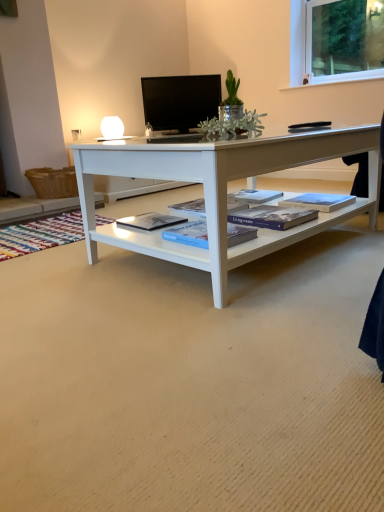
Find the location of a particular element. Image resolution: width=384 pixels, height=512 pixels. hardcover book at center, the 4th book viewed from the right is located at coordinates (151, 221).

The height and width of the screenshot is (512, 384). What do you see at coordinates (272, 217) in the screenshot?
I see `blue matte book at center, the 2th book when ordered from right to left` at bounding box center [272, 217].

Identify the location of blue matte book at center, marked as the second book in a left-to-right arrangement. (189, 234).

Measure the distance between point (x=230, y=237) and camera.

The depth of point (x=230, y=237) is 4.65 feet.

Identify the location of black glossy tv at upper center. The width and height of the screenshot is (384, 512). (180, 101).

Which is less distant, [301,202] or [189,80]?

Point [301,202] is closer to the camera than point [189,80].

From a real-world perspective, is blue hardcover book at center, which is the 1th book in right-to-left order, physically below black glossy tv at upper center?

Correct, in the physical world, blue hardcover book at center, which is the 1th book in right-to-left order, is lower than black glossy tv at upper center.

Is blue hardcover book at center, which is the fourth book from left to right, at the left side of black glossy tv at upper center?

Incorrect, blue hardcover book at center, which is the fourth book from left to right, is not on the left side of black glossy tv at upper center.

Considering the relative sizes of blue hardcover book at center, which is the fourth book from left to right, and black glossy tv at upper center in the image provided, is blue hardcover book at center, which is the fourth book from left to right, shorter than black glossy tv at upper center?

Indeed, blue hardcover book at center, which is the fourth book from left to right, has a lesser height compared to black glossy tv at upper center.

Between blue matte book at center, marked as the second book in a left-to-right arrangement, and blue matte book at center, the 2th book when ordered from right to left, which one has more height?

blue matte book at center, marked as the second book in a left-to-right arrangement, is taller.

From a real-world perspective, relative to blue matte book at center, arranged as the 3th book when viewed from the left, is blue matte book at center, arranged as the third book when viewed from the right, vertically above or below?

Clearly, from a real-world perspective, blue matte book at center, arranged as the third book when viewed from the right, is above blue matte book at center, arranged as the 3th book when viewed from the left.

Consider the image. Could you tell me if blue matte book at center, arranged as the third book when viewed from the right, is turned towards blue matte book at center, arranged as the 3th book when viewed from the left?

No, blue matte book at center, arranged as the third book when viewed from the right, is not turned towards blue matte book at center, arranged as the 3th book when viewed from the left.

From the image's perspective, is blue matte book at center, marked as the second book in a left-to-right arrangement, above blue matte book at center, the 2th book when ordered from right to left?

No, from the image's perspective, blue matte book at center, marked as the second book in a left-to-right arrangement, is not on top of blue matte book at center, the 2th book when ordered from right to left.

This screenshot has height=512, width=384. Find the location of `book below the blue matte book at center, the 2th book when ordered from right to left (from a real-world perspective)`. book below the blue matte book at center, the 2th book when ordered from right to left (from a real-world perspective) is located at coordinates (151, 221).

Considering their positions, is blue matte book at center, the 2th book when ordered from right to left, located in front of or behind hardcover book at center, the first book positioned from the left?

In the image, blue matte book at center, the 2th book when ordered from right to left, appears in front of hardcover book at center, the first book positioned from the left.

From the image's perspective, which one is positioned lower, blue matte book at center, arranged as the 3th book when viewed from the left, or hardcover book at center, the 4th book viewed from the right?

hardcover book at center, the 4th book viewed from the right.

How many degrees apart are the facing directions of blue matte book at center, the 2th book when ordered from right to left, and hardcover book at center, the first book positioned from the left?

They differ by 0.811 degrees in their facing directions.

Is hardcover book at center, the first book positioned from the left, behind blue matte book at center, arranged as the third book when viewed from the right?

Yes, hardcover book at center, the first book positioned from the left, is further from the viewer.

Is hardcover book at center, the 4th book viewed from the right, at the left side of blue matte book at center, marked as the second book in a left-to-right arrangement?

Indeed, hardcover book at center, the 4th book viewed from the right, is positioned on the left side of blue matte book at center, marked as the second book in a left-to-right arrangement.

Are hardcover book at center, the 4th book viewed from the right, and blue matte book at center, marked as the second book in a left-to-right arrangement, making contact?

There is a gap between hardcover book at center, the 4th book viewed from the right, and blue matte book at center, marked as the second book in a left-to-right arrangement.

Is hardcover book at center, the 4th book viewed from the right, turned away from blue matte book at center, arranged as the third book when viewed from the right?

Yes, hardcover book at center, the 4th book viewed from the right, is facing away from blue matte book at center, arranged as the third book when viewed from the right.

Is blue hardcover book at center, which is the 1th book in right-to-left order, bigger than blue matte book at center, the 2th book when ordered from right to left?

Yes, blue hardcover book at center, which is the 1th book in right-to-left order, is bigger than blue matte book at center, the 2th book when ordered from right to left.

Is blue hardcover book at center, which is the 1th book in right-to-left order, to the left of blue matte book at center, the 2th book when ordered from right to left, from the viewer's perspective?

No, blue hardcover book at center, which is the 1th book in right-to-left order, is not to the left of blue matte book at center, the 2th book when ordered from right to left.

Between blue hardcover book at center, which is the fourth book from left to right, and blue matte book at center, the 2th book when ordered from right to left, which one is positioned behind?

blue hardcover book at center, which is the fourth book from left to right, is further away from the camera.

Find the location of a particular element. The height and width of the screenshot is (512, 384). the 3rd book behind the blue matte book at center, arranged as the third book when viewed from the right, starting your count from the anchor is located at coordinates (319, 201).

Consider the image. Does blue hardcover book at center, which is the fourth book from left to right, have a greater width compared to blue matte book at center, marked as the second book in a left-to-right arrangement?

In fact, blue hardcover book at center, which is the fourth book from left to right, might be narrower than blue matte book at center, marked as the second book in a left-to-right arrangement.

Considering the points (339, 199) and (204, 244), which point is behind, point (339, 199) or point (204, 244)?

The point (339, 199) is behind.

Is blue hardcover book at center, which is the 1th book in right-to-left order, spatially inside blue matte book at center, marked as the second book in a left-to-right arrangement, or outside of it?

blue hardcover book at center, which is the 1th book in right-to-left order, lies outside blue matte book at center, marked as the second book in a left-to-right arrangement.

Are blue matte book at center, arranged as the 3th book when viewed from the left, and blue hardcover book at center, which is the 1th book in right-to-left order, far apart?

That's not correct — blue matte book at center, arranged as the 3th book when viewed from the left, is a little close to blue hardcover book at center, which is the 1th book in right-to-left order.

Can you tell me how much blue matte book at center, the 2th book when ordered from right to left, and blue hardcover book at center, which is the 1th book in right-to-left order, differ in facing direction?

They differ by 4.01 degrees in their facing directions.

Visually, is blue matte book at center, arranged as the 3th book when viewed from the left, positioned to the left or to the right of blue hardcover book at center, which is the 1th book in right-to-left order?

In the image, blue matte book at center, arranged as the 3th book when viewed from the left, appears on the left side of blue hardcover book at center, which is the 1th book in right-to-left order.

Which object is thinner, blue matte book at center, arranged as the 3th book when viewed from the left, or blue hardcover book at center, which is the fourth book from left to right?

blue hardcover book at center, which is the fourth book from left to right, is thinner.

Where is `television behind the blue hardcover book at center, which is the 1th book in right-to-left order`? television behind the blue hardcover book at center, which is the 1th book in right-to-left order is located at coordinates (180, 101).

Identify the location of book that is the 1st one when counting rightward from the blue matte book at center, marked as the second book in a left-to-right arrangement. The height and width of the screenshot is (512, 384). (272, 217).

From the image, which object appears to be nearer to hardcover book at center, the 4th book viewed from the right, blue hardcover book at center, which is the fourth book from left to right, or black glossy tv at upper center?

blue hardcover book at center, which is the fourth book from left to right, lies closer to hardcover book at center, the 4th book viewed from the right, than the other object.

Considering their positions, is hardcover book at center, the 4th book viewed from the right, positioned closer to blue hardcover book at center, which is the 1th book in right-to-left order, than black glossy tv at upper center?

Among the two, hardcover book at center, the 4th book viewed from the right, is located nearer to blue hardcover book at center, which is the 1th book in right-to-left order.

Based on their spatial positions, is blue hardcover book at center, which is the 1th book in right-to-left order, or blue matte book at center, arranged as the 3th book when viewed from the left, further from hardcover book at center, the first book positioned from the left?

blue hardcover book at center, which is the 1th book in right-to-left order, lies further to hardcover book at center, the first book positioned from the left, than the other object.

Considering their positions, is black glossy tv at upper center positioned further to blue hardcover book at center, which is the fourth book from left to right, than hardcover book at center, the first book positioned from the left?

black glossy tv at upper center is positioned further to the anchor blue hardcover book at center, which is the fourth book from left to right.

Considering their positions, is blue matte book at center, arranged as the 3th book when viewed from the left, positioned further to blue matte book at center, marked as the second book in a left-to-right arrangement, than blue hardcover book at center, which is the 1th book in right-to-left order?

blue hardcover book at center, which is the 1th book in right-to-left order.

In the scene shown: When comparing their distances from blue hardcover book at center, which is the fourth book from left to right, does hardcover book at center, the 4th book viewed from the right, or blue matte book at center, the 2th book when ordered from right to left, seem further?

hardcover book at center, the 4th book viewed from the right, is further to blue hardcover book at center, which is the fourth book from left to right.

From the picture: From the image, which object appears to be nearer to hardcover book at center, the 4th book viewed from the right, blue matte book at center, marked as the second book in a left-to-right arrangement, or black glossy tv at upper center?

Among the two, blue matte book at center, marked as the second book in a left-to-right arrangement, is located nearer to hardcover book at center, the 4th book viewed from the right.

From the image, which object appears to be farther from blue hardcover book at center, which is the 1th book in right-to-left order, blue matte book at center, arranged as the 3th book when viewed from the left, or blue matte book at center, arranged as the third book when viewed from the right?

blue matte book at center, arranged as the third book when viewed from the right, is further to blue hardcover book at center, which is the 1th book in right-to-left order.

This screenshot has width=384, height=512. In order to click on book positioned between hardcover book at center, the 4th book viewed from the right, and black glossy tv at upper center from near to far in this screenshot , I will do `click(319, 201)`.

What are the coordinates of `book between blue matte book at center, marked as the second book in a left-to-right arrangement, and blue hardcover book at center, which is the fourth book from left to right` in the screenshot? It's located at (272, 217).

This screenshot has width=384, height=512. In order to click on book located between hardcover book at center, the first book positioned from the left, and blue matte book at center, arranged as the 3th book when viewed from the left, in the left-right direction in this screenshot , I will do `click(189, 234)`.